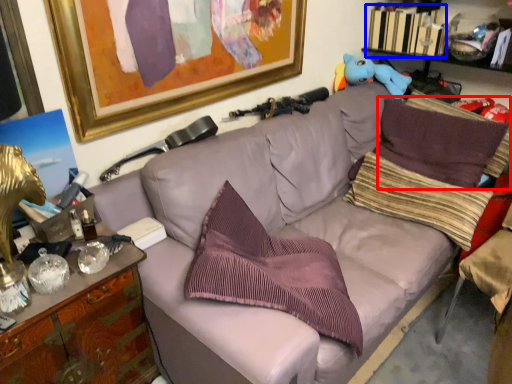
Question: Among these objects, which one is nearest to the camera, pillow (highlighted by a red box) or book (highlighted by a blue box)?

Choices:
 (A) pillow
 (B) book

Answer: (A)